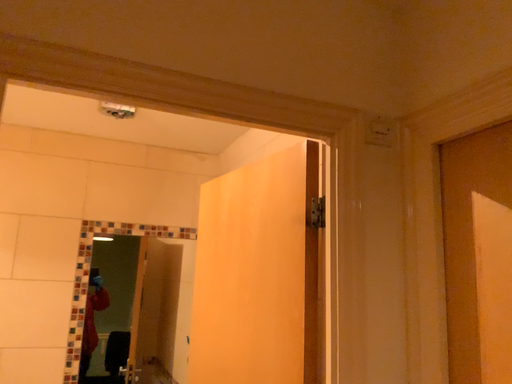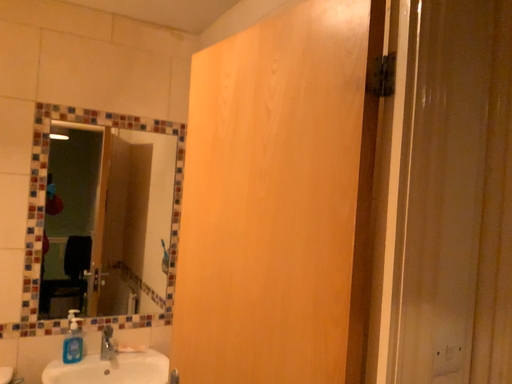
Question: How did the camera likely rotate when shooting the video?

Choices:
 (A) rotated upward
 (B) rotated downward

Answer: (B)